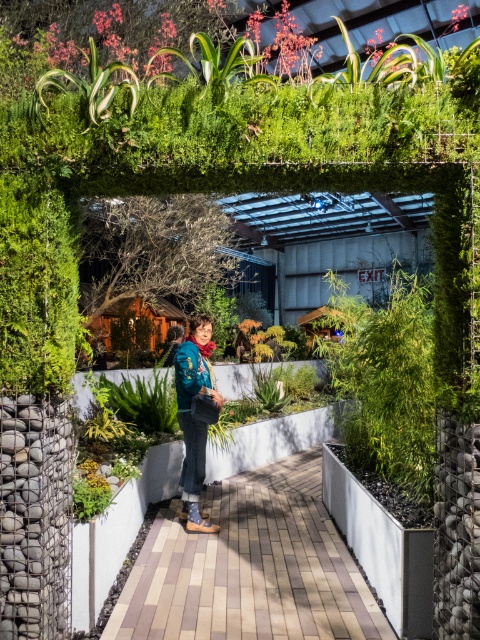
Does brick paved walkway at center have a larger size compared to denim jacket at center?

Incorrect, brick paved walkway at center is not larger than denim jacket at center.

Which is below, brick paved walkway at center or denim jacket at center?

brick paved walkway at center

The height and width of the screenshot is (640, 480). Find the location of `brick paved walkway at center`. brick paved walkway at center is located at coordinates (247, 566).

From the picture: Who is more distant from viewer, (182, 384) or (196, 368)?

Point (196, 368)

Does denim jacket at center have a smaller size compared to textured blue jacket at center?

No.

Does point (186, 468) come in front of point (178, 392)?

No, (186, 468) is further to viewer.

The width and height of the screenshot is (480, 640). I want to click on denim jacket at center, so click(x=192, y=417).

This screenshot has height=640, width=480. In order to click on brick paved walkway at center in this screenshot , I will do `click(247, 566)`.

From the picture: Who is more forward, (x=331, y=602) or (x=180, y=342)?

Point (x=331, y=602) is more forward.

Between point (179, 589) and point (182, 349), which one is positioned in front?

Positioned in front is point (179, 589).

Where is `brick paved walkway at center`? This screenshot has width=480, height=640. brick paved walkway at center is located at coordinates (247, 566).